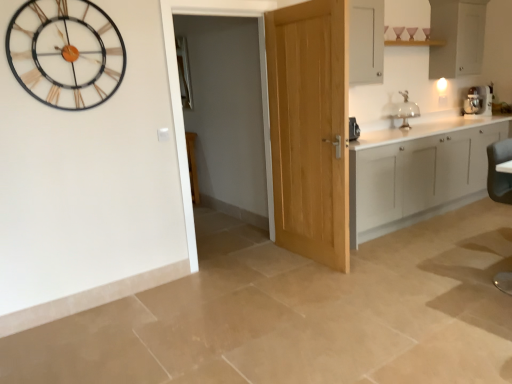
Question: Considering the relative sizes of metallic gold and black wall clock at upper left and clear glass cake stand at upper right in the image provided, is metallic gold and black wall clock at upper left wider than clear glass cake stand at upper right?

Choices:
 (A) no
 (B) yes

Answer: (A)

Question: Does metallic gold and black wall clock at upper left appear on the left side of clear glass cake stand at upper right?

Choices:
 (A) no
 (B) yes

Answer: (B)

Question: Is metallic gold and black wall clock at upper left shorter than clear glass cake stand at upper right?

Choices:
 (A) yes
 (B) no

Answer: (B)

Question: From the image's perspective, is metallic gold and black wall clock at upper left located above clear glass cake stand at upper right?

Choices:
 (A) no
 (B) yes

Answer: (B)

Question: Is metallic gold and black wall clock at upper left far away from clear glass cake stand at upper right?

Choices:
 (A) yes
 (B) no

Answer: (A)

Question: Does metallic gold and black wall clock at upper left touch clear glass cake stand at upper right?

Choices:
 (A) yes
 (B) no

Answer: (B)

Question: From a real-world perspective, is light oak door at center beneath white matte cabinet at upper right, which ranks as the 2th cabinetry in bottom-to-top order?

Choices:
 (A) yes
 (B) no

Answer: (A)

Question: Does light oak door at center turn towards white matte cabinet at upper right, which ranks as the first cabinetry in top-to-bottom order?

Choices:
 (A) yes
 (B) no

Answer: (B)

Question: Is light oak door at center thinner than white matte cabinet at upper right, which ranks as the 2th cabinetry in bottom-to-top order?

Choices:
 (A) yes
 (B) no

Answer: (A)

Question: Is light oak door at center positioned with its back to white matte cabinet at upper right, which ranks as the 2th cabinetry in bottom-to-top order?

Choices:
 (A) yes
 (B) no

Answer: (A)

Question: From a real-world perspective, is light oak door at center located higher than white matte cabinet at upper right, which ranks as the 2th cabinetry in bottom-to-top order?

Choices:
 (A) yes
 (B) no

Answer: (B)

Question: Considering the relative sizes of light oak door at center and white matte cabinet at upper right, which ranks as the 2th cabinetry in bottom-to-top order, in the image provided, is light oak door at center bigger than white matte cabinet at upper right, which ranks as the 2th cabinetry in bottom-to-top order,?

Choices:
 (A) no
 (B) yes

Answer: (B)

Question: Is white matte cabinetry at right, the 1th cabinetry ordered from the bottom, at the left side of metallic gold and black wall clock at upper left?

Choices:
 (A) yes
 (B) no

Answer: (B)